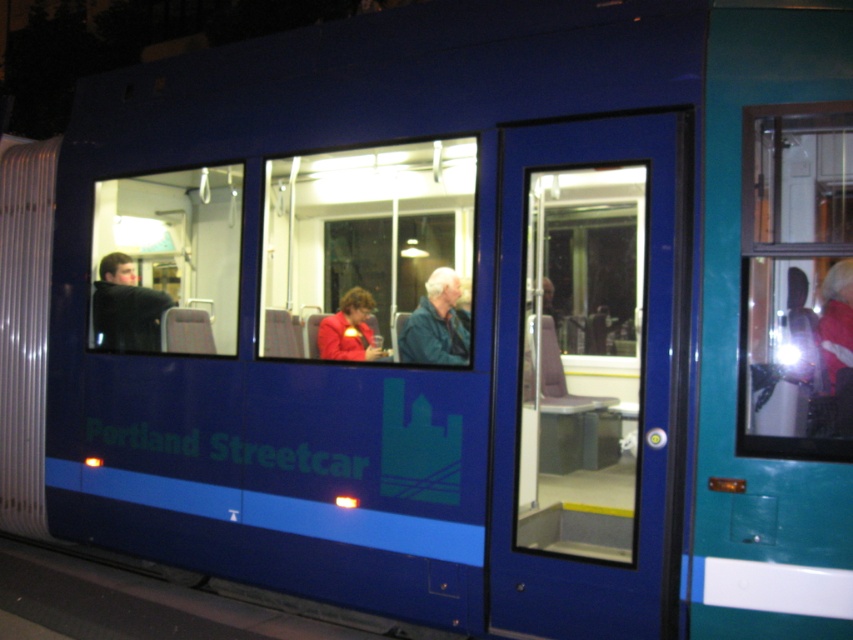
Question: Can you confirm if matte glass window at center is positioned to the left of matte black jacket at left?

Choices:
 (A) no
 (B) yes

Answer: (A)

Question: Is matte glass window at center below blue leather jacket at center?

Choices:
 (A) yes
 (B) no

Answer: (B)

Question: Is the position of matte glass window at center more distant than that of blue leather jacket at center?

Choices:
 (A) yes
 (B) no

Answer: (B)

Question: Which point appears closest to the camera in this image?

Choices:
 (A) (131, 326)
 (B) (593, 381)

Answer: (A)

Question: Which point is farther to the camera?

Choices:
 (A) (578, 483)
 (B) (105, 339)
 (C) (132, 316)
 (D) (339, 358)

Answer: (C)

Question: Among these points, which one is farthest from the camera?

Choices:
 (A) (164, 296)
 (B) (784, 124)
 (C) (376, 355)
 (D) (386, 260)

Answer: (D)